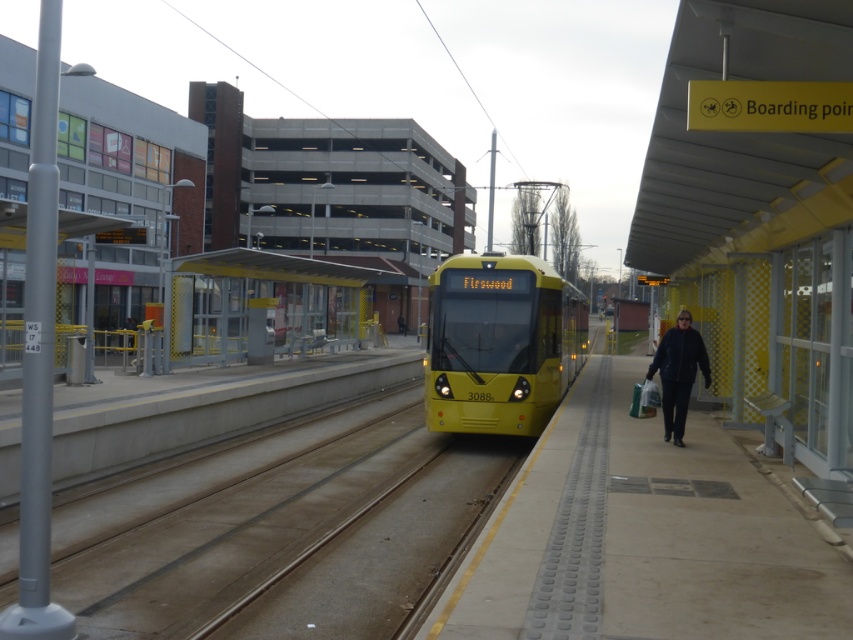
Who is positioned more to the left, smooth concrete platform at center or yellow metallic bus stop at center?

From the viewer's perspective, yellow metallic bus stop at center appears more on the left side.

Which is in front, point (728, 570) or point (207, 262)?

Point (728, 570) is more forward.

Identify the location of smooth concrete platform at center. The width and height of the screenshot is (853, 640). (643, 538).

Identify the location of smooth concrete platform at center. (643, 538).

Is yellow matte train at center further to the viewer compared to dark blue leather jacket at center?

Yes, yellow matte train at center is behind dark blue leather jacket at center.

Is the position of yellow matte train at center less distant than that of dark blue leather jacket at center?

No, it is not.

Measure the distance between yellow matte train at center and camera.

They are 13.61 meters apart.

Locate an element on the screen. The height and width of the screenshot is (640, 853). yellow matte train at center is located at coordinates (500, 342).

Is smooth concrete platform at center to the right of dark blue leather jacket at center from the viewer's perspective?

No, smooth concrete platform at center is not to the right of dark blue leather jacket at center.

I want to click on smooth concrete platform at center, so click(643, 538).